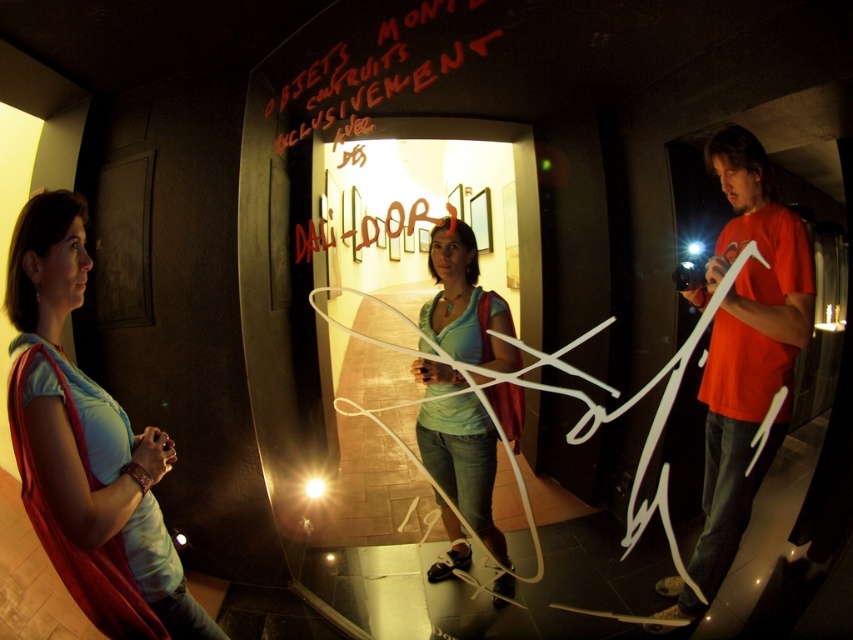
Question: Can you confirm if matte red t-shirt at right is thinner than matte teal shirt at center?

Choices:
 (A) yes
 (B) no

Answer: (A)

Question: Is matte red t-shirt at right wider than matte teal shirt at center?

Choices:
 (A) no
 (B) yes

Answer: (A)

Question: Estimate the real-world distances between objects in this image. Which object is closer to the matte red t-shirt at right?

Choices:
 (A) blue fabric scarf at left
 (B) matte teal shirt at center

Answer: (B)

Question: Which of the following is the farthest from the observer?

Choices:
 (A) [744, 291]
 (B) [79, 232]
 (C) [482, 532]

Answer: (C)

Question: Considering the real-world distances, which object is farthest from the blue fabric scarf at left?

Choices:
 (A) matte red t-shirt at right
 (B) matte teal shirt at center

Answer: (A)

Question: Can you confirm if matte red t-shirt at right is thinner than matte teal shirt at center?

Choices:
 (A) no
 (B) yes

Answer: (B)